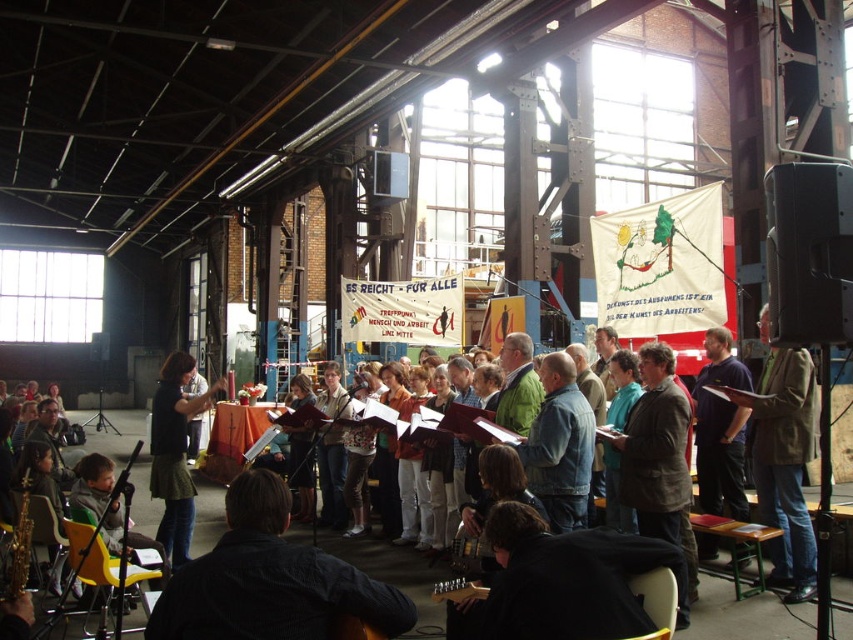
Question: Among these points, which one is farthest from the camera?

Choices:
 (A) (164, 435)
 (B) (778, 579)
 (C) (242, 584)

Answer: (A)

Question: Can you confirm if dark blue shirt at center is positioned above brown leather jacket at right?

Choices:
 (A) no
 (B) yes

Answer: (B)

Question: Does dark blue shirt at center have a smaller size compared to green fabric skirt at center?

Choices:
 (A) yes
 (B) no

Answer: (A)

Question: Which point is farther to the camera?

Choices:
 (A) brown leather jacket at right
 (B) green fabric skirt at center

Answer: (B)

Question: Is dark blue shirt at center thinner than brown leather jacket at right?

Choices:
 (A) yes
 (B) no

Answer: (B)

Question: Which point appears closest to the camera in this image?

Choices:
 (A) (792, 451)
 (B) (186, 362)
 (C) (265, 518)

Answer: (C)